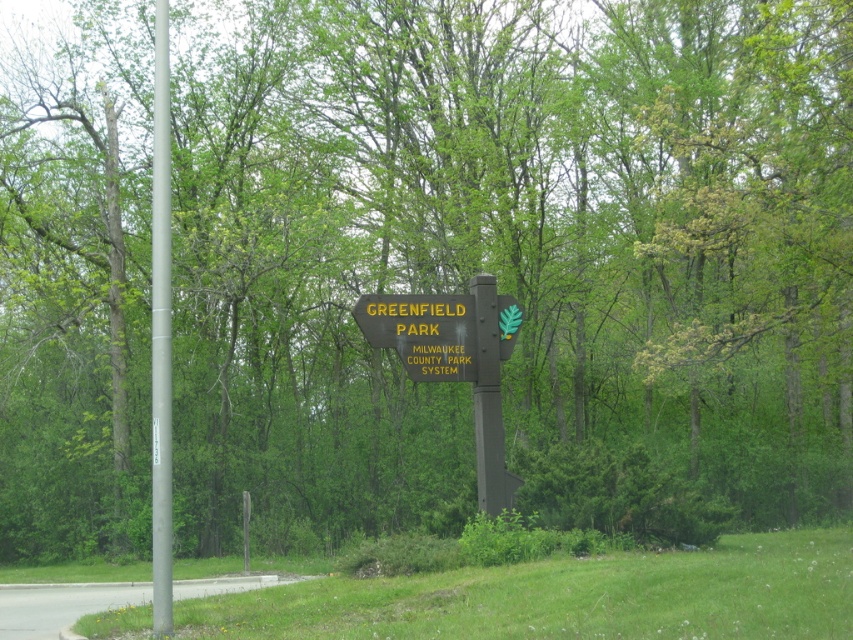
You are a park visitor standing in front of the black metal signpost at center. You notice a silver metallic pole at left. Which object is closer to you?

The silver metallic pole at left is closer to you since it is in front of the black metal signpost at center.

You are a park visitor who wants to find the entrance to Greenfield Park. You see a silver metallic pole at left and a black metal signpost at center. Which object is closer to you?

The silver metallic pole at left is positioned over the black metal signpost at center, meaning it is closer to you.

You are standing at the entrance of Greenfield Park and want to reach the point marked at coordinates point (399, 316). Given that the park has a paved road on the left side of the frame, can you estimate how far you need to walk to reach that point?

The point (399, 316) is 17.25 meters away from the viewer, so you need to walk approximately 17.25 meters to reach it.